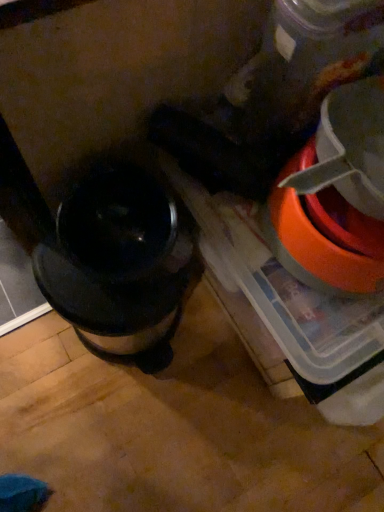
Question: Considering the relative positions of shiny metallic coffee maker at left and orange plastic bowl at right in the image provided, is shiny metallic coffee maker at left to the left or to the right of orange plastic bowl at right?

Choices:
 (A) left
 (B) right

Answer: (A)

Question: Does point (105, 294) appear closer or farther from the camera than point (317, 274)?

Choices:
 (A) farther
 (B) closer

Answer: (A)

Question: Is shiny metallic coffee maker at left taller or shorter than orange plastic bowl at right?

Choices:
 (A) short
 (B) tall

Answer: (B)

Question: From their relative heights in the image, would you say orange plastic bowl at right is taller or shorter than shiny metallic coffee maker at left?

Choices:
 (A) tall
 (B) short

Answer: (B)

Question: In terms of width, does orange plastic bowl at right look wider or thinner when compared to shiny metallic coffee maker at left?

Choices:
 (A) thin
 (B) wide

Answer: (A)

Question: In the image, is orange plastic bowl at right positioned in front of or behind shiny metallic coffee maker at left?

Choices:
 (A) behind
 (B) front

Answer: (B)

Question: Would you say orange plastic bowl at right is to the left or to the right of shiny metallic coffee maker at left in the picture?

Choices:
 (A) right
 (B) left

Answer: (A)